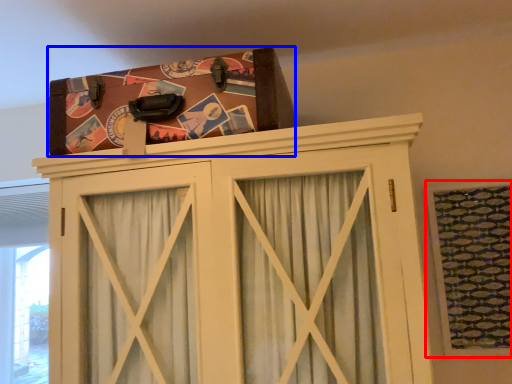
Question: Among these objects, which one is farthest to the camera, window (highlighted by a red box) or package (highlighted by a blue box)?

Choices:
 (A) window
 (B) package

Answer: (A)